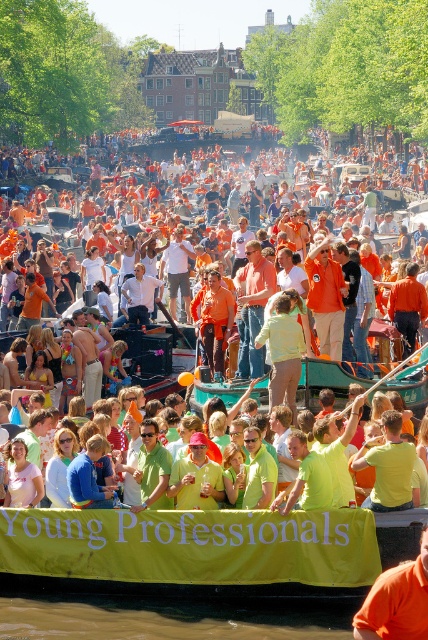
Between green fabric boat at center and orange matte shirt at center, which one appears on the right side from the viewer's perspective?

From the viewer's perspective, green fabric boat at center appears more on the right side.

Who is higher up, green fabric boat at center or orange matte shirt at center?

orange matte shirt at center

Describe the element at coordinates (324, 378) in the screenshot. This screenshot has width=428, height=640. I see `green fabric boat at center` at that location.

Locate an element on the screen. green fabric boat at center is located at coordinates (324, 378).

Between matte orange shirt at center and pastel green fabric at center, which one appears on the left side from the viewer's perspective?

matte orange shirt at center

Between matte orange shirt at center and pastel green fabric at center, which one has less height?

Standing shorter between the two is pastel green fabric at center.

What are the coordinates of `matte orange shirt at center` in the screenshot? It's located at (184, 168).

Identify the location of matte orange shirt at center. The image size is (428, 640). (184, 168).

Is point (88, 296) farther from camera compared to point (425, 588)?

Yes, it is behind point (425, 588).

Where is `matte orange shirt at center`? matte orange shirt at center is located at coordinates [184, 168].